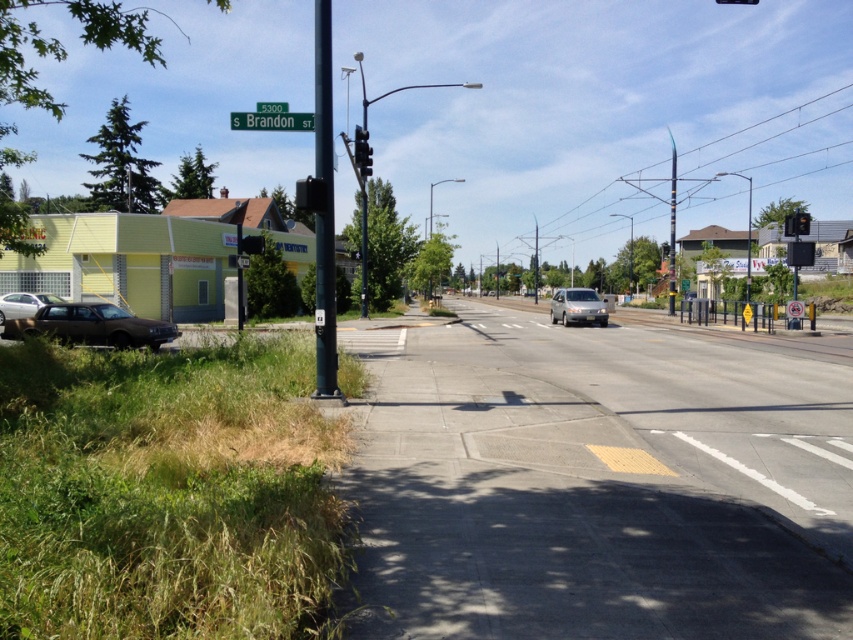
You are a delivery person trying to park your van on the sidewalk. The sidewalk is next to the road where the silver van is driving away. You need to know if the green matte pole at center and the black plastic traffic light at upper right are wide enough to block your parking spot. Which object is wider?

The green matte pole at center is wider than the black plastic traffic light at upper right, so the pole may block the parking spot more than the traffic light.

You are standing on the sidewalk and want to reach the metallic pole at center. There is a green plastic street sign at upper center in your way. Can you walk straight towards the pole without going around the sign?

The metallic pole at center is further to the viewer than the green plastic street sign at upper center, so the sign is closer to you. Therefore, you cannot walk straight towards the pole without first passing the sign.

You are a delivery driver who needs to know the distance between the metallic traffic light at center and the red glass traffic light at upper right to plan your route. Can you determine which traffic light is wider?

The metallic traffic light at center is wider than the red glass traffic light at upper right.